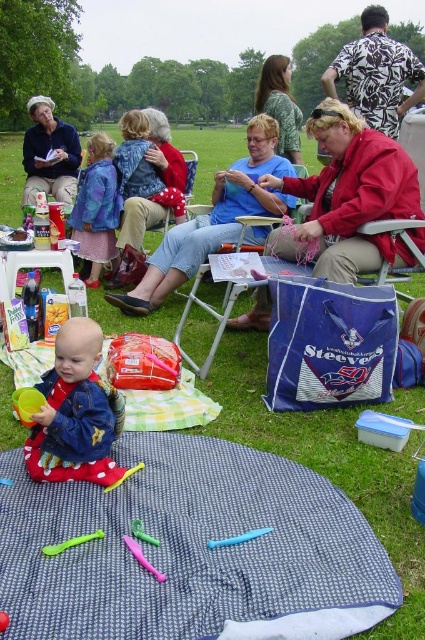
You are at a park and see a blue printed fabric blanket at lower center and a camouflage fabric shirt at center. Which item is closer to the ground?

The blue printed fabric blanket at lower center is closer to the ground because it is located below the camouflage fabric shirt at center.

You are organizing a clothing donation drive and need to sort items by size. You have a red fleece jacket at center and a camouflage fabric shirt at center. Which item should you place in the small size bin?

The red fleece jacket at center has a smaller size compared to the camouflage fabric shirt at center, so it should be placed in the small size bin.

You are a parent at the park and want to pick up the blue plastic toy at lower center. You are currently holding the blue printed fabric blanket at lower center. Can you reach the toy without letting go of the blanket?

The distance between the blue printed fabric blanket at lower center and the blue plastic toy at lower center is 11.27 inches, so yes, you can easily reach the toy while holding the blanket since the distance is manageable.